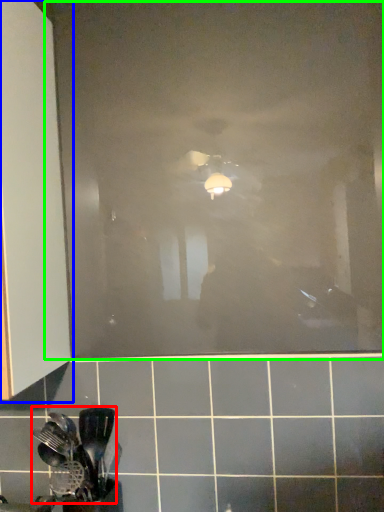
Question: Estimate the real-world distances between objects in this image. Which object is closer to spatula (highlighted by a red box), cabinetry (highlighted by a blue box) or glass door (highlighted by a green box)?

Choices:
 (A) cabinetry
 (B) glass door

Answer: (A)